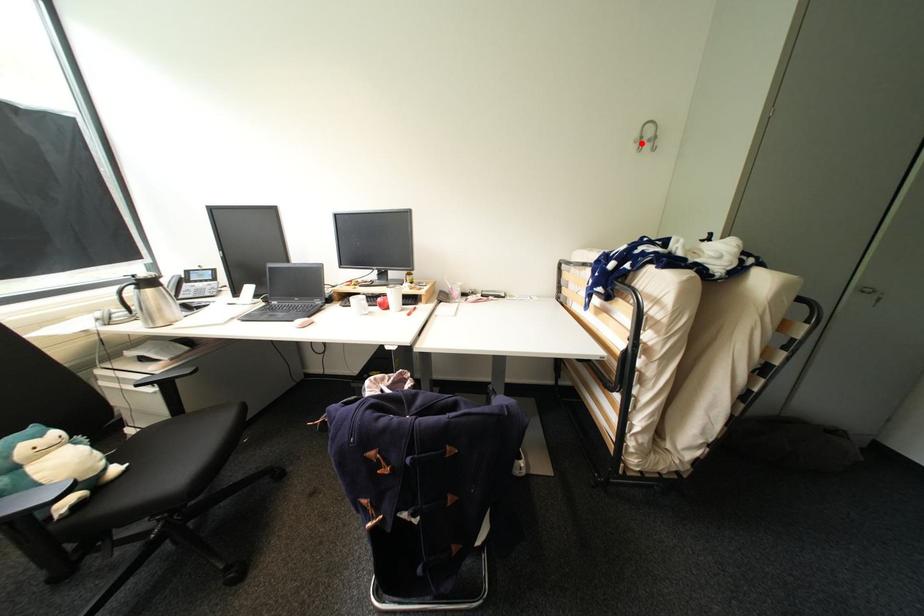
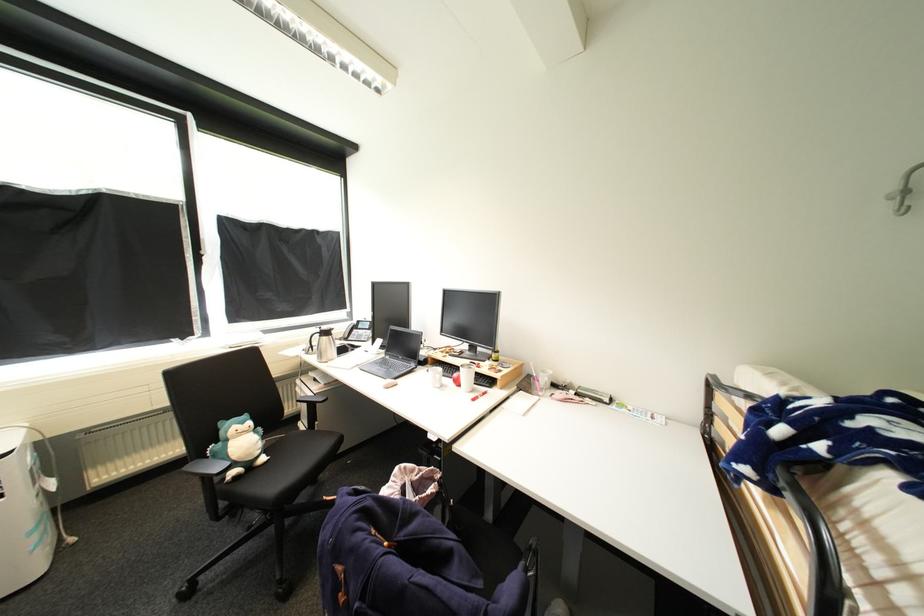
Find the pixel in the second image that matches the highlighted location in the first image.

(900, 199)